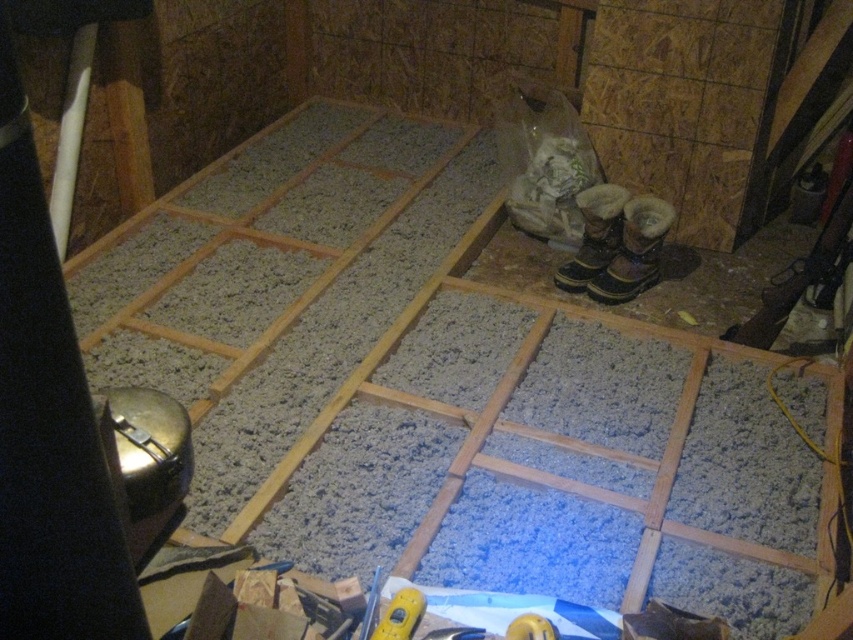
You are a contractor standing in the middle of the floor. You need to determine which of the two points, point (579, 275) or point (418, 595), is closer to you. Which one is closer?

Point (579, 275) is closer to you because it is further to the viewer than point (418, 595).

You are a construction worker who needs to place a tool on the floor. You have two boots in view, a brown leather boot at right and a brown suede boot at center. Which boot is located to the right of the other?

The brown leather boot at right is positioned on the right side of the brown suede boot at center, so the brown leather boot at right is to the right of the brown suede boot at center.